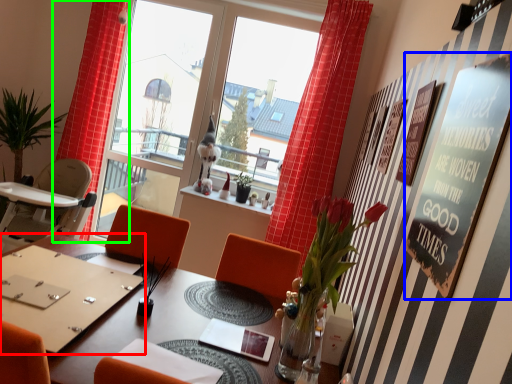
Question: Considering the real-world distances, which object is farthest from round table (highlighted by a red box)? bulletin board (highlighted by a blue box) or curtain (highlighted by a green box)?

Choices:
 (A) bulletin board
 (B) curtain

Answer: (B)